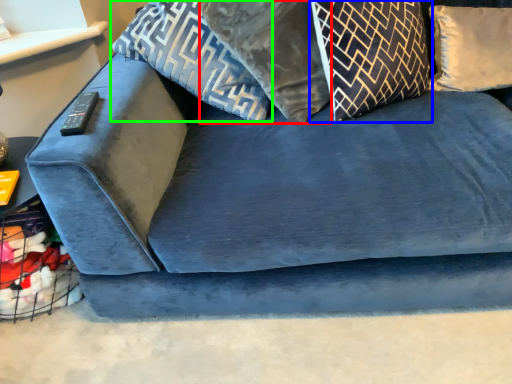
Question: Which object is the closest to the pillow (highlighted by a red box)? Choose among these: pillow (highlighted by a blue box) or pillow (highlighted by a green box).

Choices:
 (A) pillow
 (B) pillow

Answer: (B)